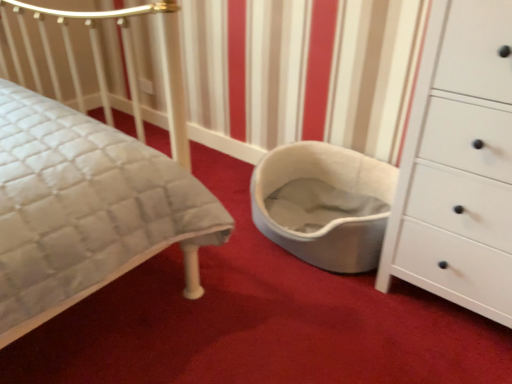
The height and width of the screenshot is (384, 512). In order to click on vacant area to the left of soft gray fabric pet bed at center in this screenshot , I will do `click(203, 250)`.